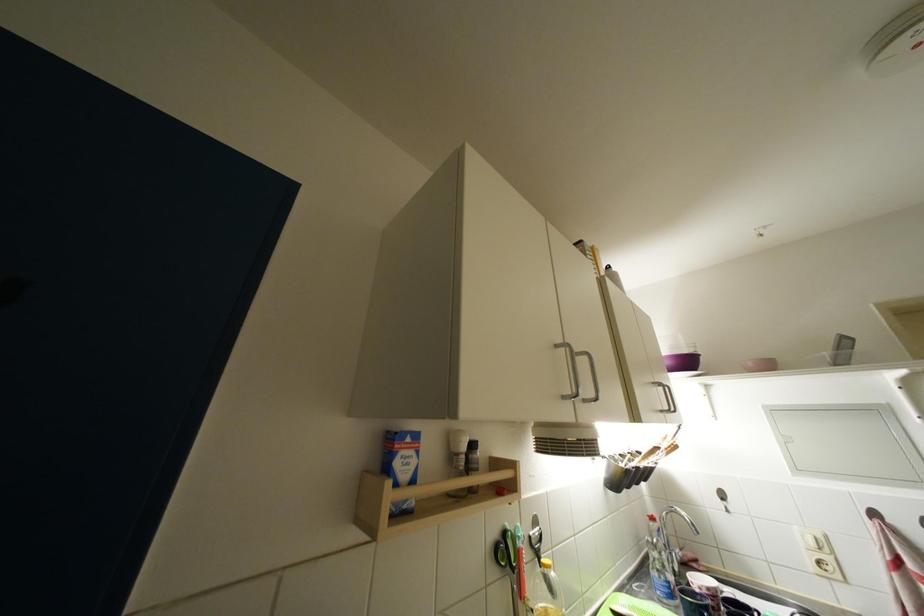
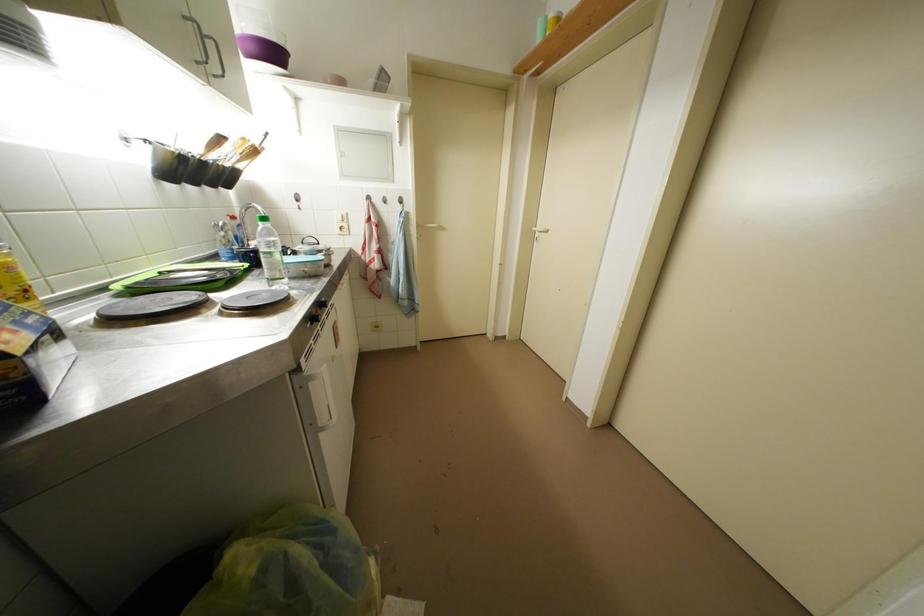
First-person continuous shooting, in which direction is the camera rotating?

The camera rotated toward right-down.